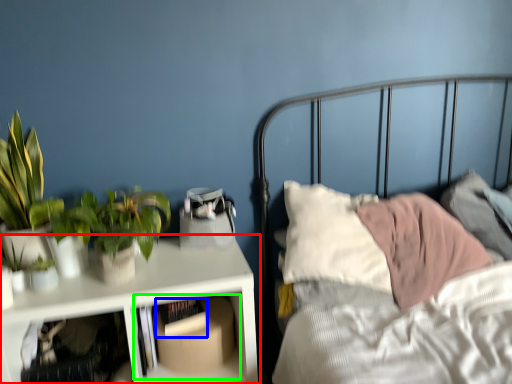
Question: Which is nearer to the table (highlighted by a red box)? book (highlighted by a blue box) or shelf (highlighted by a green box).

Choices:
 (A) book
 (B) shelf

Answer: (B)